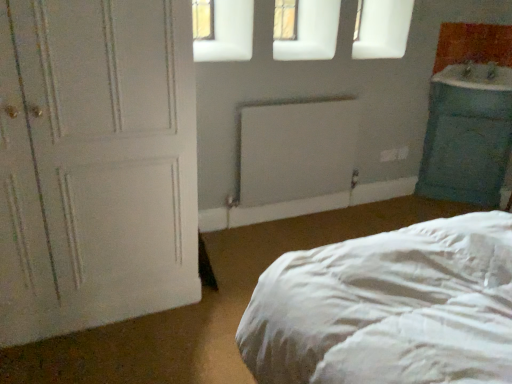
Where is `free location to the left of teal fabric pillow at right`? The height and width of the screenshot is (384, 512). free location to the left of teal fabric pillow at right is located at coordinates (405, 205).